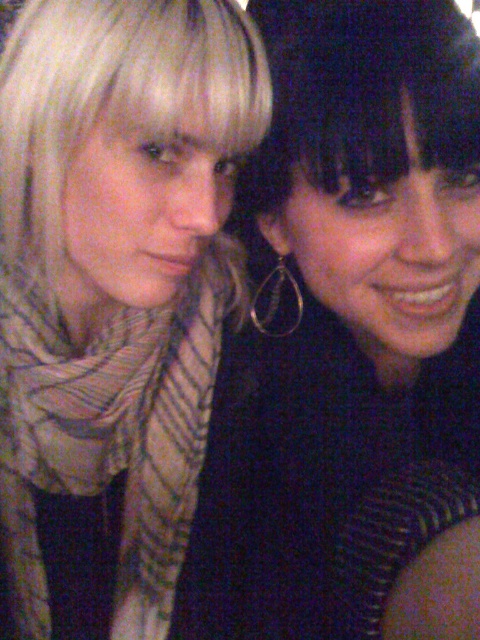
Question: Which point is closer to the camera?

Choices:
 (A) (111, 122)
 (B) (168, 108)

Answer: (B)

Question: Which of the following is the farthest from the observer?

Choices:
 (A) striped scarf at left
 (B) matte black top at center

Answer: (A)

Question: Is the position of matte black top at center less distant than that of blondehair at left?

Choices:
 (A) no
 (B) yes

Answer: (B)

Question: Can you confirm if matte black top at center is thinner than blondehair at left?

Choices:
 (A) no
 (B) yes

Answer: (B)

Question: Does striped scarf at left appear on the left side of blondehair at left?

Choices:
 (A) no
 (B) yes

Answer: (B)

Question: Among these points, which one is nearest to the camera?

Choices:
 (A) (17, 234)
 (B) (430, 337)
 (C) (158, 33)

Answer: (C)